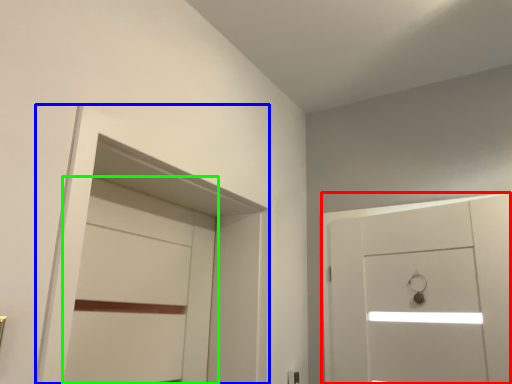
Question: Which object is positioned closest to door (highlighted by a red box)? Select from locker (highlighted by a blue box) and door (highlighted by a green box).

Choices:
 (A) locker
 (B) door

Answer: (A)